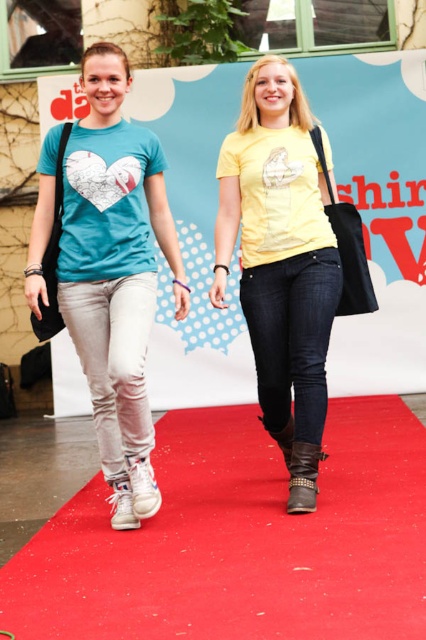
Question: Among these points, which one is nearest to the camera?

Choices:
 (A) (138, 481)
 (B) (284, 397)
 (C) (244, 467)
 (D) (310, 458)

Answer: (A)

Question: Which of these objects is positioned closest to the matte blue t-shirt at center?

Choices:
 (A) white suede boot at lower left
 (B) red carpet at center
 (C) white leather boot at lower left

Answer: (A)

Question: Which object is farther from the camera taking this photo?

Choices:
 (A) matte blue t-shirt at center
 (B) red carpet at center
 (C) white leather boot at lower left
 (D) white suede boot at lower left

Answer: (C)

Question: Can you confirm if red carpet at center is wider than matte blue t-shirt at center?

Choices:
 (A) no
 (B) yes

Answer: (B)

Question: Does leather studded boot at center lie behind white leather boot at lower left?

Choices:
 (A) yes
 (B) no

Answer: (B)

Question: From the image, what is the correct spatial relationship of yellow matte t-shirt at center in relation to white suede boot at lower left?

Choices:
 (A) left
 (B) right

Answer: (B)